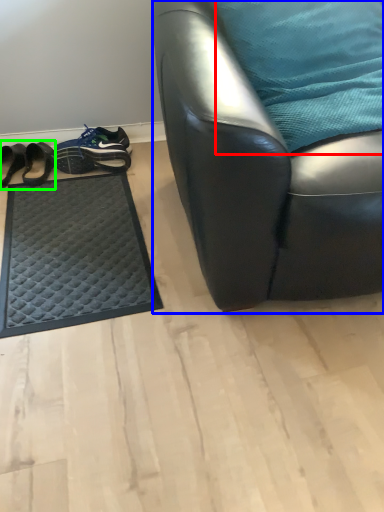
Question: Estimate the real-world distances between objects in this image. Which object is farther from pillow (highlighted by a red box), chair (highlighted by a blue box) or footwear (highlighted by a green box)?

Choices:
 (A) chair
 (B) footwear

Answer: (B)